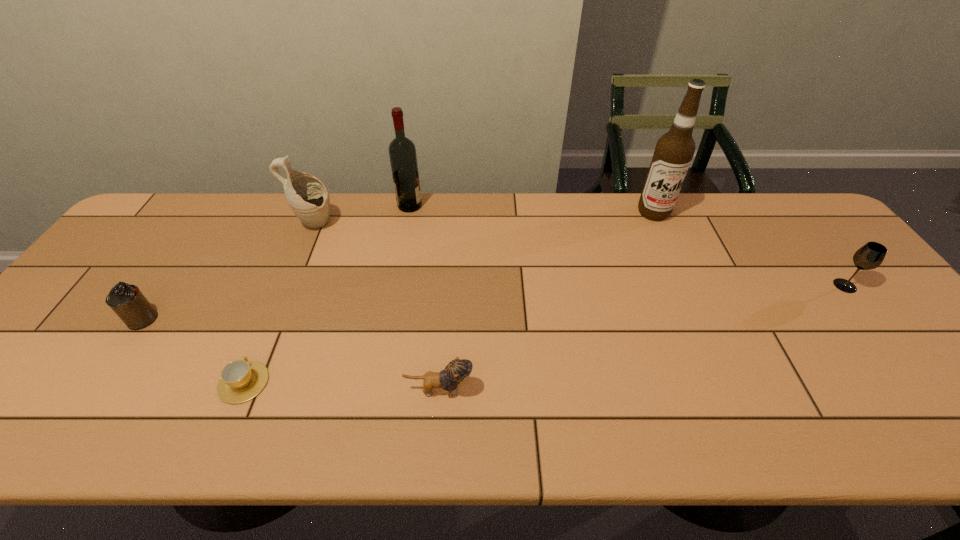
In order to click on pitcher present at the far edge in this screenshot , I will do `click(307, 196)`.

Identify the location of object at the near edge. (241, 380).

The height and width of the screenshot is (540, 960). I want to click on object that is at the right edge, so click(x=871, y=255).

The image size is (960, 540). I want to click on vacant space at the far edge of the desktop, so click(263, 227).

Where is `free location at the near edge`? free location at the near edge is located at coordinates (247, 432).

The height and width of the screenshot is (540, 960). I want to click on vacant region at the right edge of the desktop, so click(x=851, y=319).

The height and width of the screenshot is (540, 960). In the image, there is a desktop. Identify the location of vacant space at the far right corner. (793, 203).

Locate an element on the screen. The width and height of the screenshot is (960, 540). free space between the pitcher and the cup is located at coordinates pyautogui.click(x=279, y=303).

Locate an element on the screen. vacant area between the fifth shortest object and the cup is located at coordinates click(x=279, y=303).

At what (x,y) coordinates should I click in order to perform the action: click on vacant area between the fourth object from right to left and the fifth shortest object. Please return your answer as a coordinate pair (x, y). Looking at the image, I should click on (362, 215).